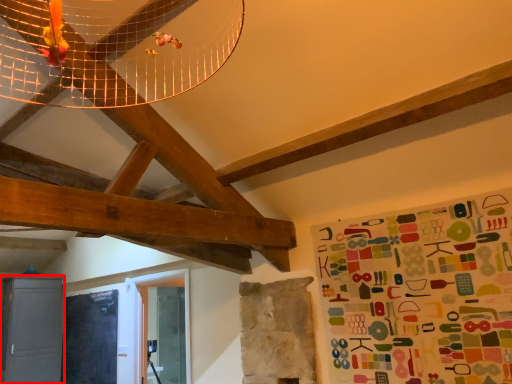
Question: From the image's perspective, what is the correct spatial positioning of cabinetry (annotated by the red box) in reference to bulletin board?

Choices:
 (A) above
 (B) below

Answer: (B)